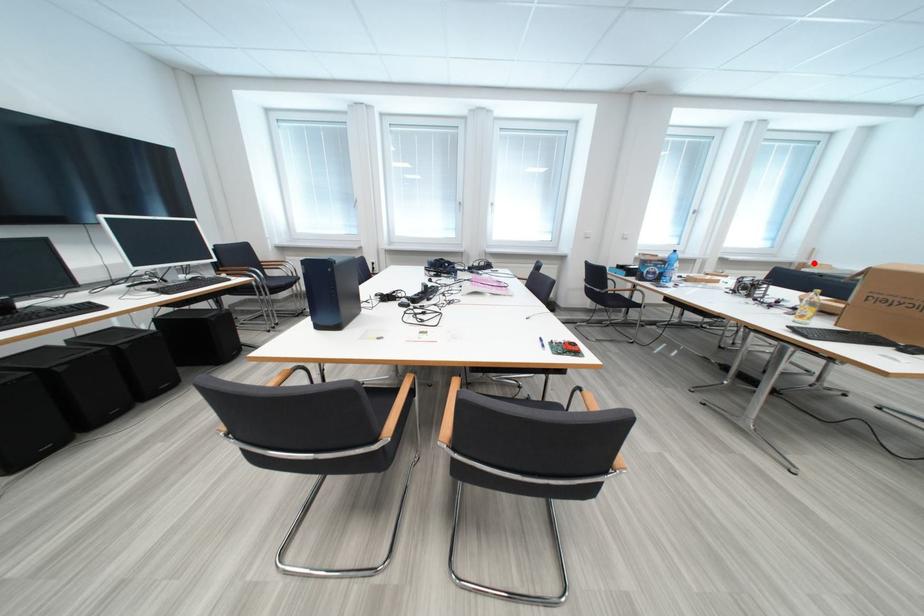
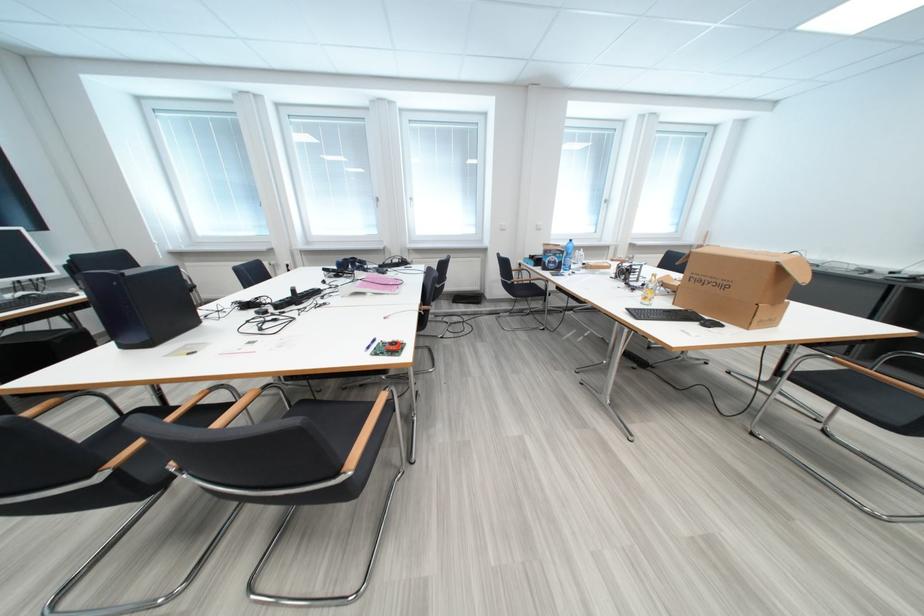
Where in the second image is the point corresponding to the highlighted location from the first image?

(711, 245)